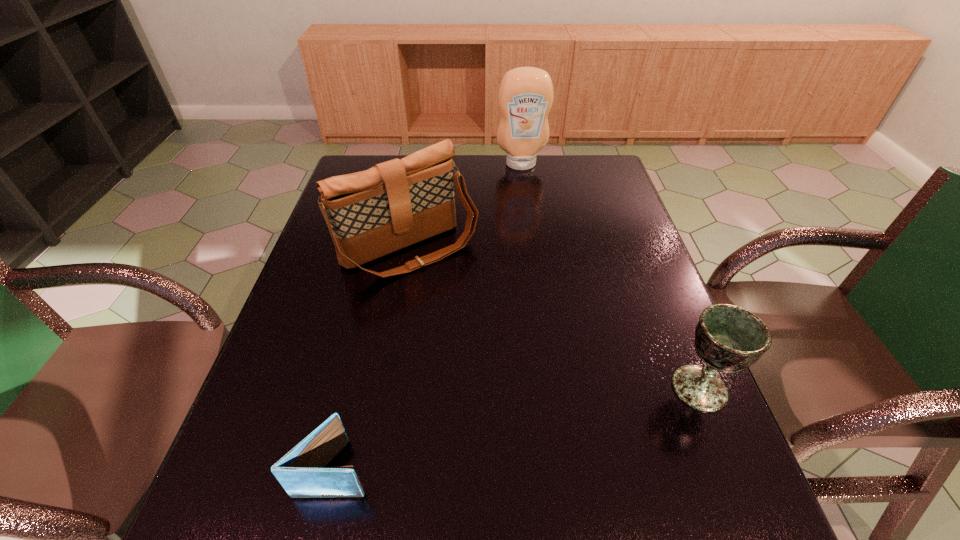
Locate an element on the screen. Image resolution: width=960 pixels, height=540 pixels. the shortest object is located at coordinates (301, 472).

Identify the location of wallet. Image resolution: width=960 pixels, height=540 pixels. (301, 472).

This screenshot has height=540, width=960. What are the coordinates of `chalice` in the screenshot? It's located at (728, 338).

I want to click on the second shortest object, so click(728, 338).

Find the location of a particular element. the third shortest object is located at coordinates (372, 213).

At what (x,y) coordinates should I click in order to perform the action: click on shoulder bag. Please return your answer as a coordinate pair (x, y). The image size is (960, 540). Looking at the image, I should click on (372, 213).

This screenshot has height=540, width=960. Find the location of `condiment`. condiment is located at coordinates (525, 97).

Where is `the tallest object`? This screenshot has width=960, height=540. the tallest object is located at coordinates (525, 97).

Identify the location of vacant space located 0.230m on the exterior surface of the nearest object. click(499, 468).

At what (x,y) coordinates should I click in order to perform the action: click on vacant space situated on the left of the second shortest object. Please return your answer as a coordinate pair (x, y). Looking at the image, I should click on (500, 388).